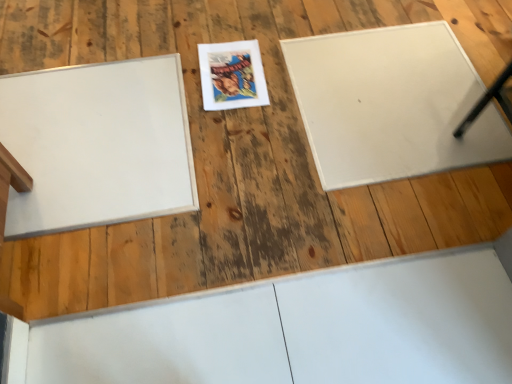
Question: In terms of width, does white matte board at left, which appears as the 2th bulletin board when viewed from the right, look wider or thinner when compared to white matte board at upper right, which appears as the 1th bulletin board when viewed from the right?

Choices:
 (A) wide
 (B) thin

Answer: (B)

Question: From their relative heights in the image, would you say white matte board at left, which is the first bulletin board in left-to-right order, is taller or shorter than white matte board at upper right, which appears as the 1th bulletin board when viewed from the right?

Choices:
 (A) short
 (B) tall

Answer: (B)

Question: Considering the real-world distances, which object is farthest from the white matte board at upper right, which is the 2th bulletin board in left-to-right order?

Choices:
 (A) matte paper comic book at center
 (B) white matte board at left, which appears as the 2th bulletin board when viewed from the right

Answer: (B)

Question: Considering the real-world distances, which object is closest to the matte paper comic book at center?

Choices:
 (A) white matte board at left, which appears as the 2th bulletin board when viewed from the right
 (B) white matte board at upper right, which appears as the 1th bulletin board when viewed from the right

Answer: (A)